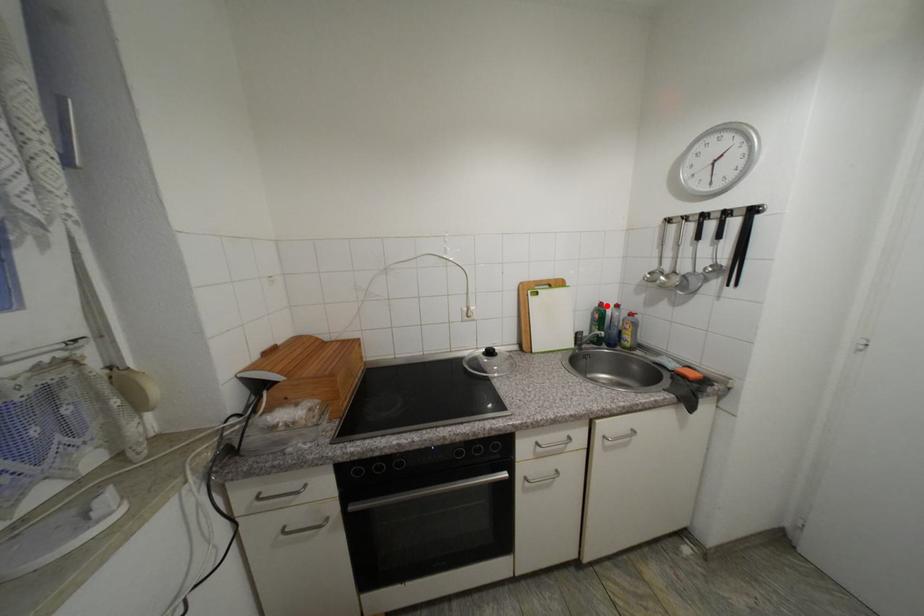
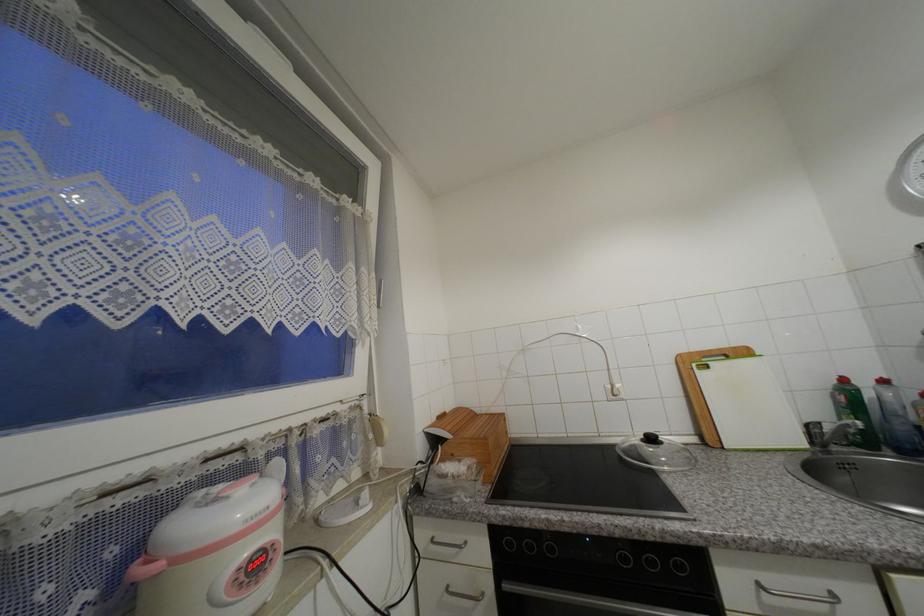
Find the pixel in the second image that matches the highlighted location in the first image.

(849, 381)